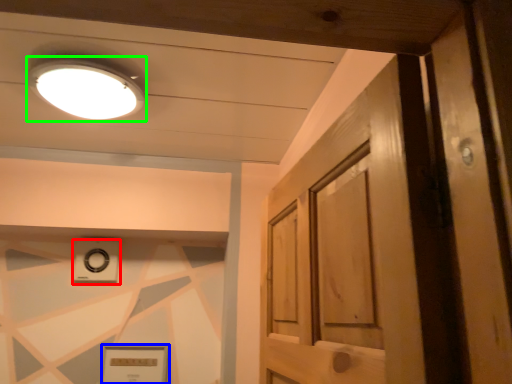
Question: Which object is the farthest from knob (highlighted by a red box)? Choose among these: picture frame (highlighted by a blue box) or lighting (highlighted by a green box).

Choices:
 (A) picture frame
 (B) lighting

Answer: (B)